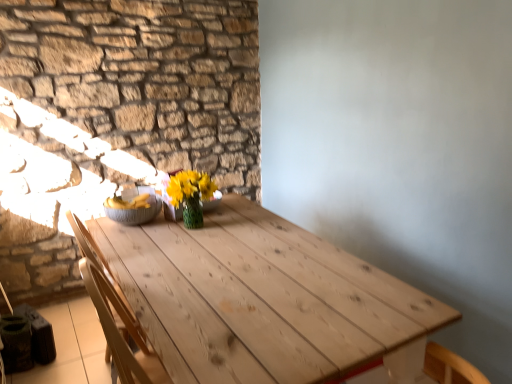
The width and height of the screenshot is (512, 384). Describe the element at coordinates (116, 314) in the screenshot. I see `wooden chair at center` at that location.

Image resolution: width=512 pixels, height=384 pixels. I want to click on wooden chair at center, so click(116, 314).

Where is `wooden chair at center`? This screenshot has width=512, height=384. wooden chair at center is located at coordinates (116, 314).